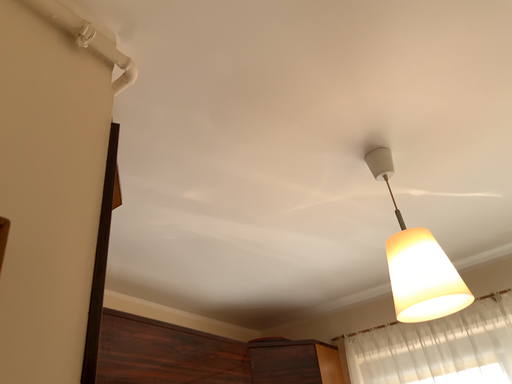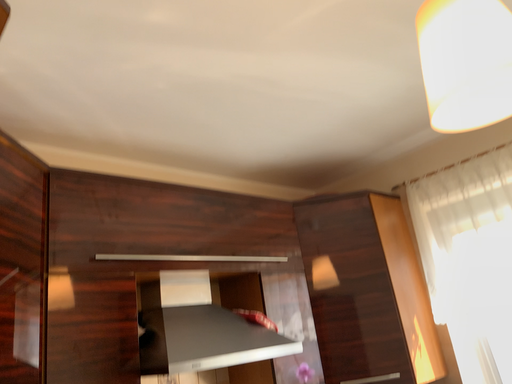
Question: Which way did the camera rotate in the video?

Choices:
 (A) rotated upward
 (B) rotated downward

Answer: (B)